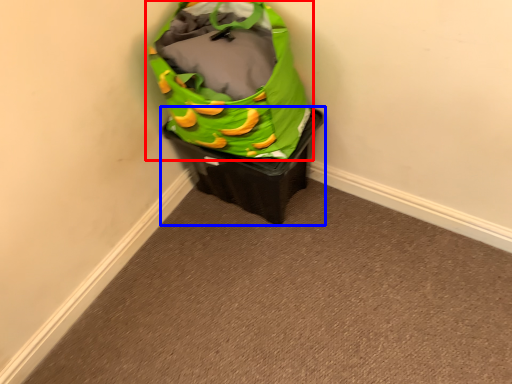
Question: Among these objects, which one is nearest to the camera, luggage and bags (highlighted by a red box) or waste container (highlighted by a blue box)?

Choices:
 (A) luggage and bags
 (B) waste container

Answer: (A)